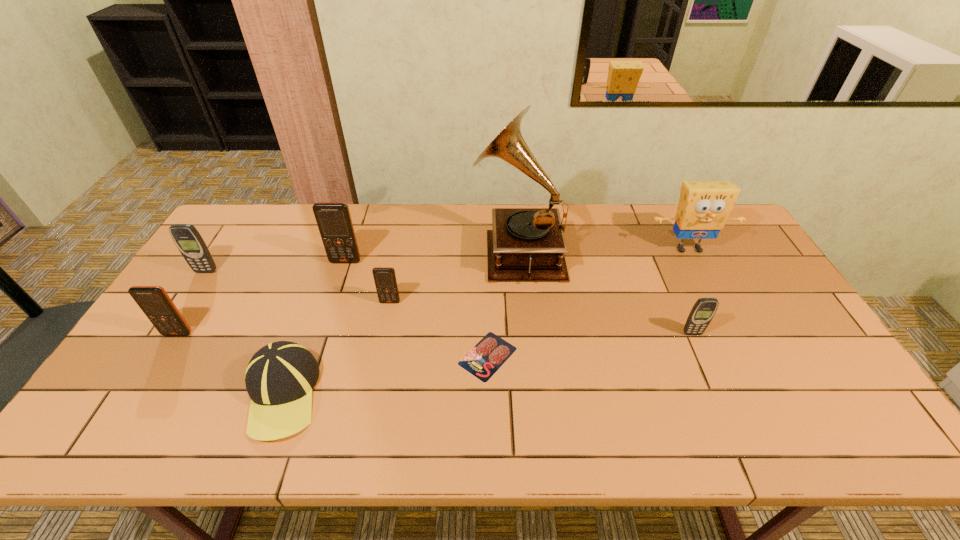
This screenshot has width=960, height=540. I want to click on object that is positioned at the far right corner, so click(703, 208).

Locate an element on the screen. This screenshot has height=540, width=960. vacant space at the far edge of the desktop is located at coordinates (450, 221).

Locate an element on the screen. free space at the near edge is located at coordinates (188, 440).

This screenshot has width=960, height=540. I want to click on vacant space at the right edge, so click(750, 257).

This screenshot has width=960, height=540. Find the location of `free space at the near left corner of the desktop`. free space at the near left corner of the desktop is located at coordinates (163, 419).

The image size is (960, 540). Identify the location of free region at the far right corner. (737, 232).

In the image, there is a desktop. In order to click on free space at the near right corner in this screenshot , I will do `click(815, 414)`.

Identify the location of vacant point located between the nearest orange cellular telephone and the brown record player. (348, 292).

The image size is (960, 540). Find the location of `vacant point located between the shortest object and the smaller gray cellular telephone`. vacant point located between the shortest object and the smaller gray cellular telephone is located at coordinates (589, 345).

This screenshot has height=540, width=960. I want to click on vacant space in between the leftmost orange cellular telephone and the third farthest cellular telephone, so click(x=284, y=318).